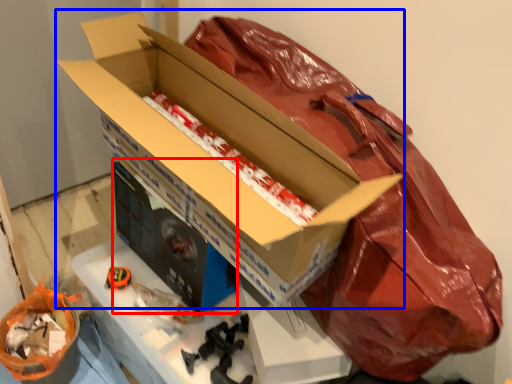
Question: Which object is closer to the camera taking this photo, box (highlighted by a red box) or box (highlighted by a blue box)?

Choices:
 (A) box
 (B) box

Answer: (B)